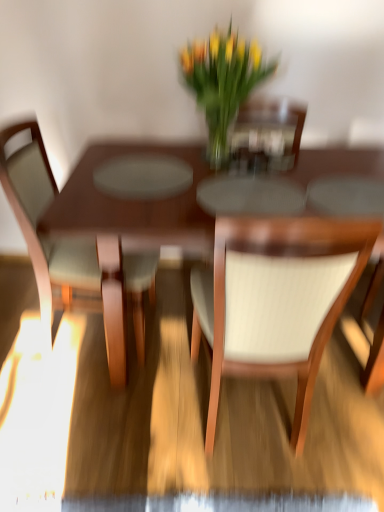
Question: In the image, is translucent glass vase at center positioned in front of or behind white textured chair at center, which appears as the second chair when viewed from the left?

Choices:
 (A) front
 (B) behind

Answer: (B)

Question: Is translucent glass vase at center inside the boundaries of white textured chair at center, the 1th chair in the right-to-left sequence, or outside?

Choices:
 (A) inside
 (B) outside

Answer: (B)

Question: Estimate the real-world distances between objects in this image. Which object is farther from the wooden table at center?

Choices:
 (A) white textured chair at center, which appears as the second chair when viewed from the left
 (B) light brown wood chair at left, marked as the first chair in a left-to-right arrangement
 (C) translucent glass vase at center

Answer: (C)

Question: Considering the real-world distances, which object is closest to the white textured chair at center, which appears as the second chair when viewed from the left?

Choices:
 (A) wooden table at center
 (B) light brown wood chair at left, the second chair from the right
 (C) translucent glass vase at center

Answer: (A)